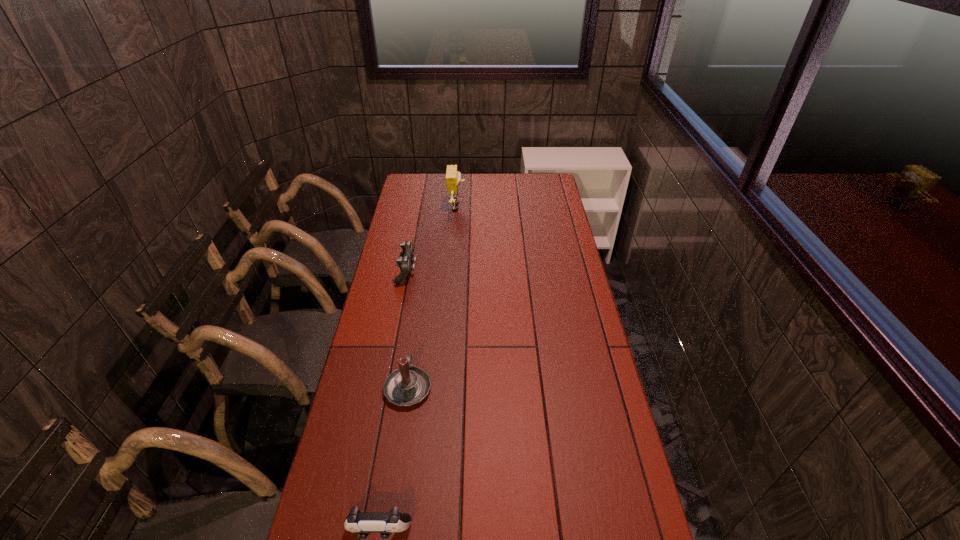
Image resolution: width=960 pixels, height=540 pixels. In order to click on the farthest object in this screenshot , I will do `click(453, 177)`.

I want to click on the tallest object, so click(x=453, y=177).

You are a GUI agent. You are given a task and a screenshot of the screen. Output one action in this format:
    pyautogui.click(x=<x>, y=<y>)
    Task: Click on the candle
    This screenshot has height=540, width=960.
    Given the screenshot: What is the action you would take?
    pyautogui.click(x=409, y=385)

Identify the location of the third shortest object. This screenshot has width=960, height=540. (409, 385).

The width and height of the screenshot is (960, 540). Identify the location of the farther control. (405, 261).

Locate an element on the screen. The width and height of the screenshot is (960, 540). blank area located on the face of the farthest object is located at coordinates (527, 208).

The width and height of the screenshot is (960, 540). Identify the location of blank area located 0.330m on the side of the candle with the handle loop. (421, 296).

Image resolution: width=960 pixels, height=540 pixels. Find the location of `vacant space located on the side of the candle with the handle loop`. vacant space located on the side of the candle with the handle loop is located at coordinates (420, 310).

Find the location of a particular element. This screenshot has width=960, height=540. free space located 0.350m on the side of the candle with the handle loop is located at coordinates (421, 292).

Where is `free space located on the surface of the farther control with buttons`? free space located on the surface of the farther control with buttons is located at coordinates (508, 272).